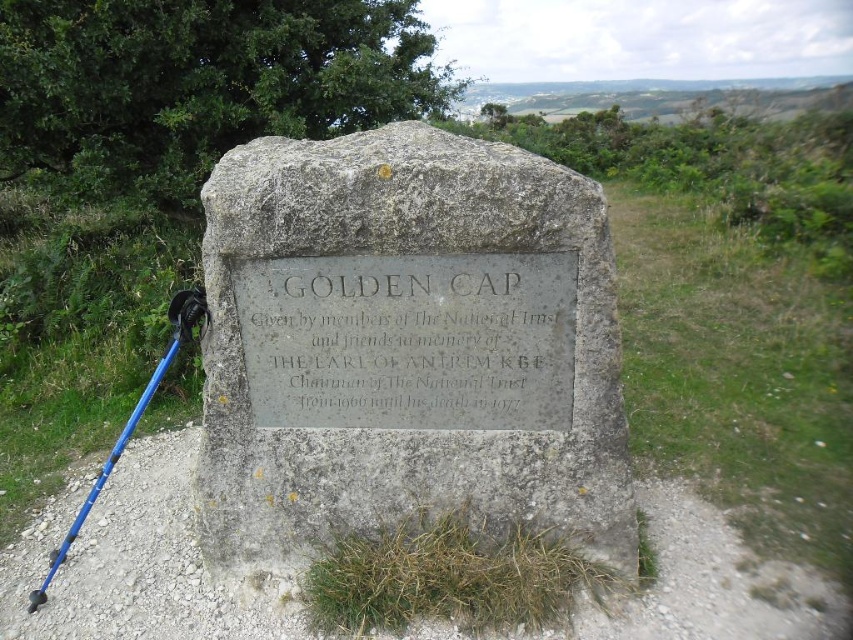
Who is higher up, gray stone plaque at center or blue plastic ski pole at lower left?

gray stone plaque at center

Who is more forward, (436, 416) or (194, 307)?

Point (194, 307) is in front.

Locate an element on the screen. gray stone plaque at center is located at coordinates (405, 344).

Does silver/grey stone plaque at center have a lesser width compared to blue plastic ski pole at lower left?

No.

Who is more forward, (532,380) or (82,506)?

Positioned in front is point (532,380).

Which is in front, point (248, 307) or point (51, 573)?

Positioned in front is point (248, 307).

This screenshot has height=640, width=853. Identify the location of silver/grey stone plaque at center. (409, 340).

Identify the location of gray stone plaque at center. (405, 344).

Can you confirm if gray stone plaque at center is taller than silver/grey stone plaque at center?

Yes, gray stone plaque at center is taller than silver/grey stone plaque at center.

Looking at this image, who is more forward, (380, 256) or (312, 381)?

Point (380, 256) is in front.

In order to click on gray stone plaque at center in this screenshot , I will do `click(405, 344)`.